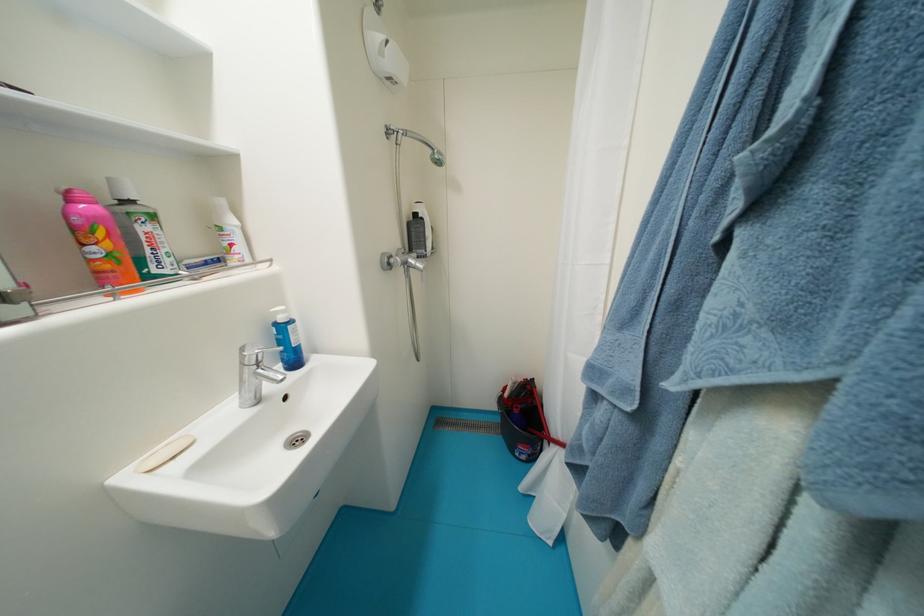
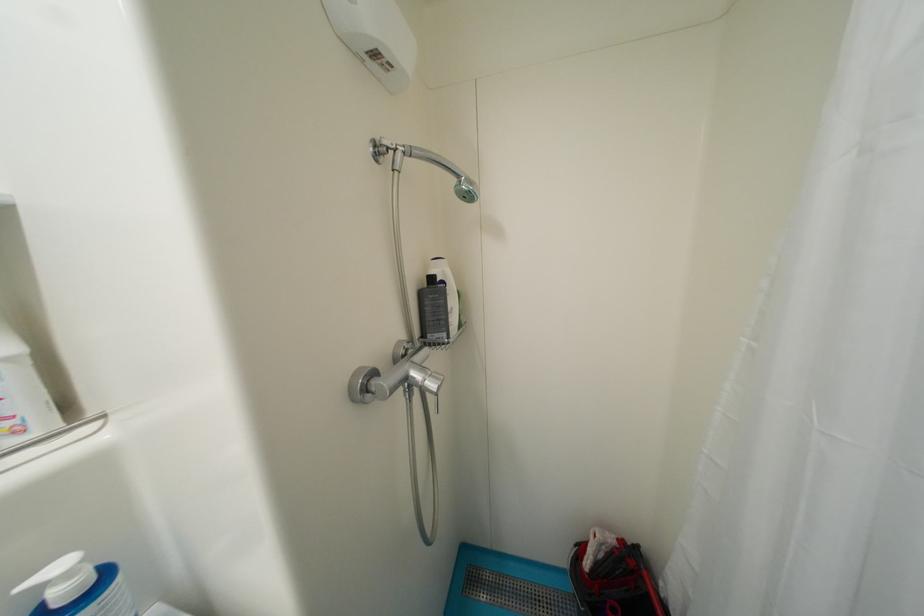
Locate, in the second image, the point that corresponds to point 421,217 in the first image.

(439, 281)